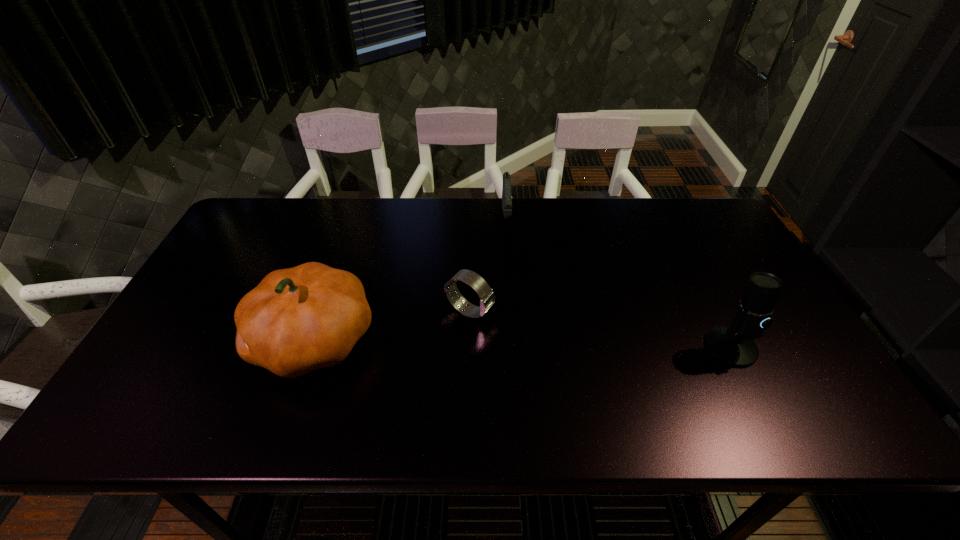
I want to click on vacant space at the far edge of the desktop, so click(635, 240).

This screenshot has width=960, height=540. I want to click on free location at the near edge, so click(x=351, y=386).

You are a GUI agent. You are given a task and a screenshot of the screen. Output one action in this format:
    pyautogui.click(x=<x>, y=<y>)
    Task: Click on the vacant region at the left edge of the desktop
    The image size is (960, 540).
    Given the screenshot: What is the action you would take?
    pyautogui.click(x=273, y=247)

In the image, there is a desktop. At what (x,y) coordinates should I click in order to perform the action: click on vacant space at the right edge. Please return your answer as a coordinate pair (x, y). This screenshot has height=540, width=960. Looking at the image, I should click on (776, 316).

Identify the location of vacant region at the far right corner of the desktop. (700, 240).

The width and height of the screenshot is (960, 540). In order to click on free space between the pistol and the leftmost object in this screenshot , I will do `click(410, 279)`.

You are a GUI agent. You are given a task and a screenshot of the screen. Output one action in this format:
    pyautogui.click(x=<x>, y=<y>)
    Task: Click on the vacant space that is in between the pistol and the microphone
    This screenshot has height=540, width=960.
    Given the screenshot: What is the action you would take?
    (x=618, y=283)

This screenshot has height=540, width=960. I want to click on free space that is in between the rightmost object and the watch, so 600,329.

Identify the location of vacant area between the leftmost object and the pistol. (410, 279).

At what (x,y) coordinates should I click in order to perform the action: click on unoccupied position between the third object from right to left and the rightmost object. Please return your answer as a coordinate pair (x, y). Image resolution: width=960 pixels, height=540 pixels. Looking at the image, I should click on (600, 329).